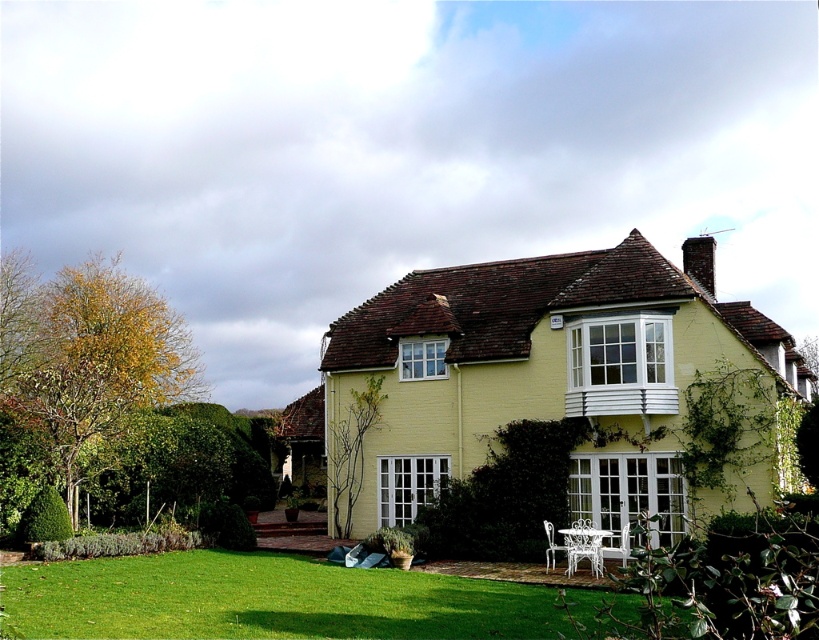
You are standing in front of the house and notice the green grass at lower center and the green leafy hedge at center. Which of these two is closer to you?

The green grass at lower center is closer to you because it is positioned over the green leafy hedge at center, indicating it is in front of the hedge.

You are standing at the front door of the house and want to place a garden gnome exactly at the green grass at lower center. According to the image, what are the coordinates where you should place it?

The green grass at lower center is located at coordinates point (265, 600), so you should place the garden gnome there.